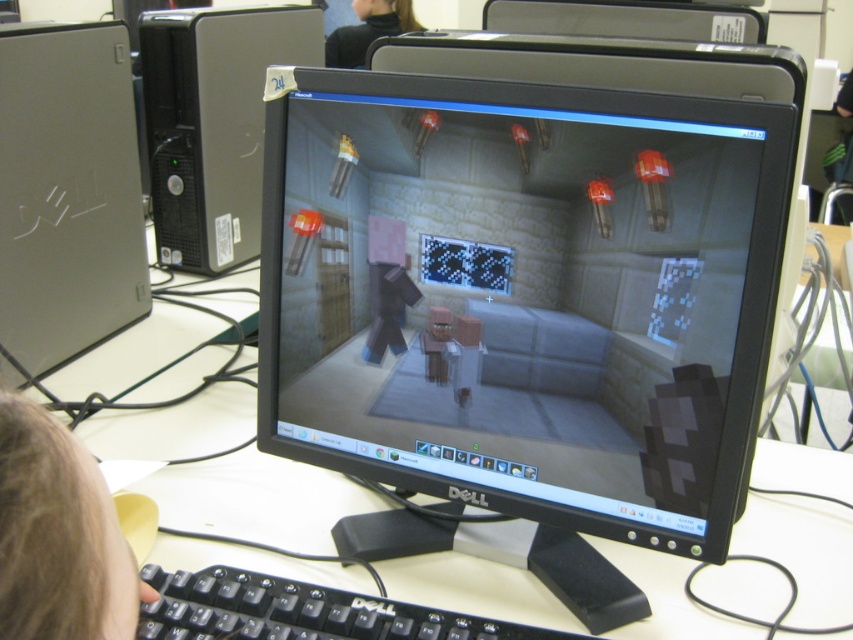
You are a character in the Minecraft game looking at the screen. You notice the brown hair at lower left and the black fabric at upper center. Which object is closer to you in the real world?

The brown hair at lower left is closer to you because it is in front of the black fabric at upper center.

You are a delivery person who needs to place a box on the white glossy computer desk at center and the black plastic monitor at upper center. Which surface can accommodate the box without it touching the monitor?

The white glossy computer desk at center has a greater height compared to the black plastic monitor at upper center, so placing the box on the desk will prevent it from touching the monitor.

You are setting up a new desk and want to place the gray matte monitor at center and the silver metallic computer tower at left. According to the image, what is the minimum distance you should leave between them to ensure proper setup?

The minimum distance you should leave between the gray matte monitor at center and the silver metallic computer tower at left is 22.48 inches to ensure proper setup.